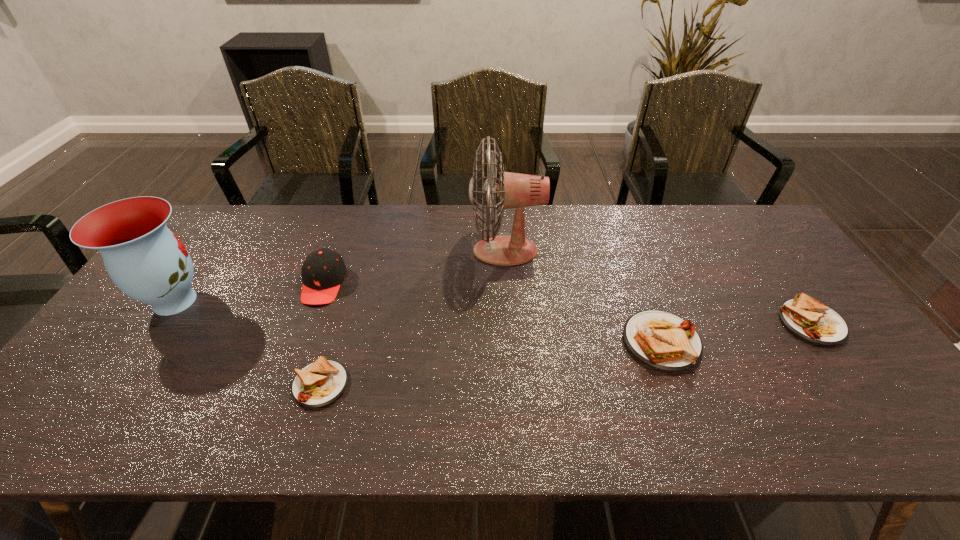
The height and width of the screenshot is (540, 960). Find the location of `unoccupied area between the shortest sandwich and the rightmost sandwich`. unoccupied area between the shortest sandwich and the rightmost sandwich is located at coordinates (566, 354).

Where is `unoccupied position between the fourth tallest object and the fourth shortest object`? unoccupied position between the fourth tallest object and the fourth shortest object is located at coordinates (492, 313).

The height and width of the screenshot is (540, 960). I want to click on unoccupied position between the fourth shortest object and the rightmost sandwich, so click(x=567, y=303).

Locate an element on the screen. The height and width of the screenshot is (540, 960). free area in between the cap and the fan is located at coordinates (415, 267).

This screenshot has width=960, height=540. Identify the location of empty space between the second tallest object and the leftmost sandwich. (248, 343).

This screenshot has width=960, height=540. What are the coordinates of `object that is the closest to the cap` in the screenshot? It's located at (320, 383).

Find the location of a particular element. This screenshot has height=540, width=960. the fifth closest object relative to the shortest object is located at coordinates (807, 318).

Find the location of `sandwich that stands as the second closest to the vase`. sandwich that stands as the second closest to the vase is located at coordinates (661, 340).

I want to click on the third closest sandwich relative to the cap, so click(807, 318).

The image size is (960, 540). I want to click on vacant space that satisfies the following two spatial constraints: 1. on the front side of the fifth shortest object; 2. on the right side of the fourth tallest object, so click(146, 342).